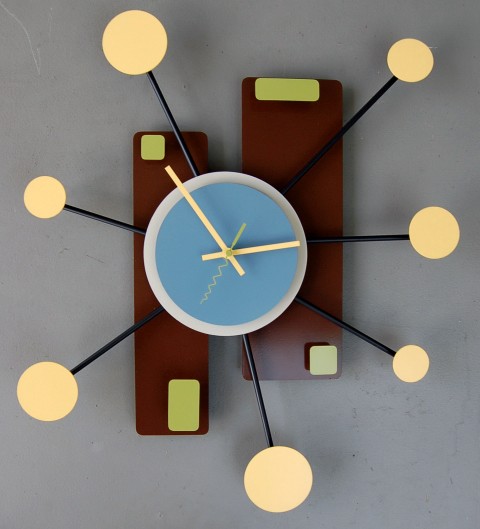
This screenshot has width=480, height=529. What are the coordinates of `clock` in the screenshot? It's located at (261, 222).